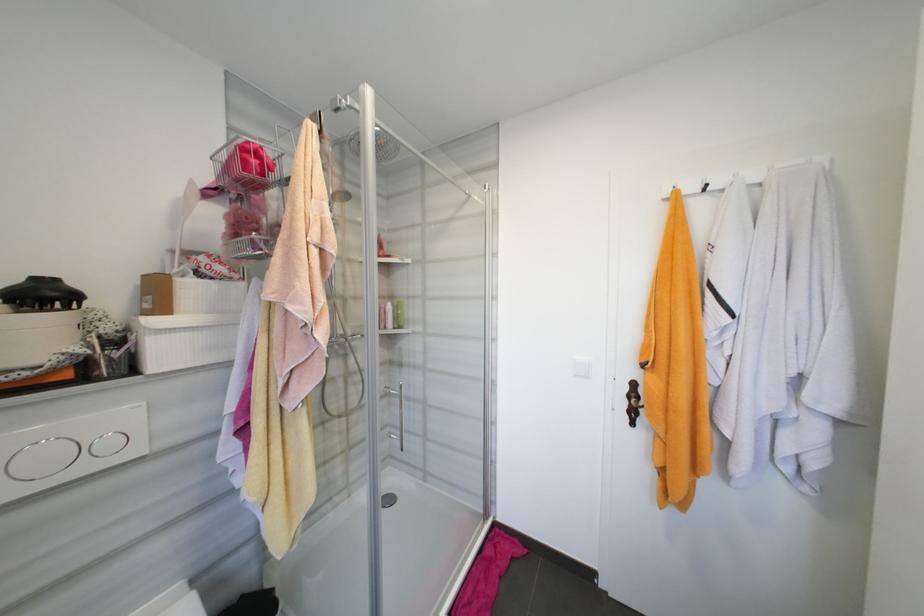
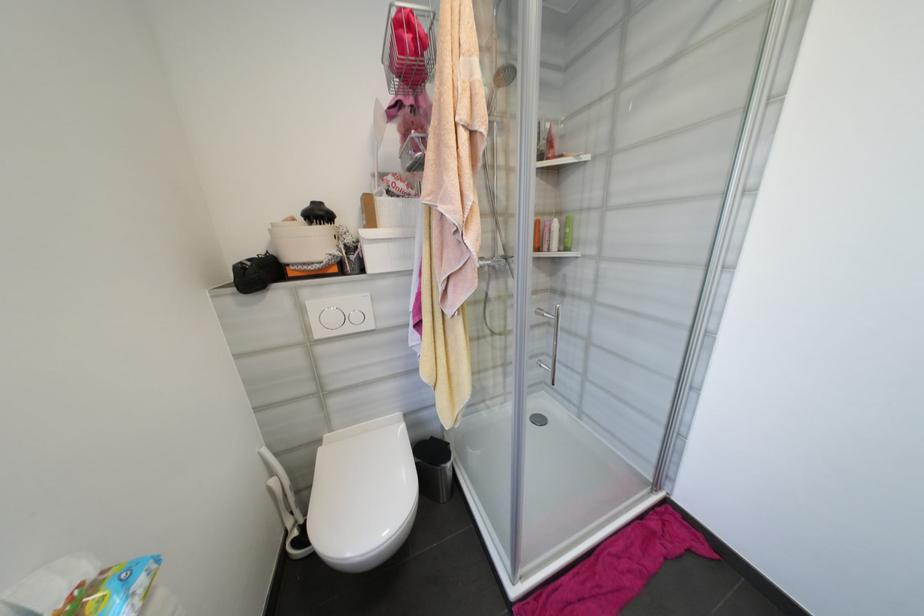
Find the pixel in the second image that matches [115,445] in the first image.

(361, 318)